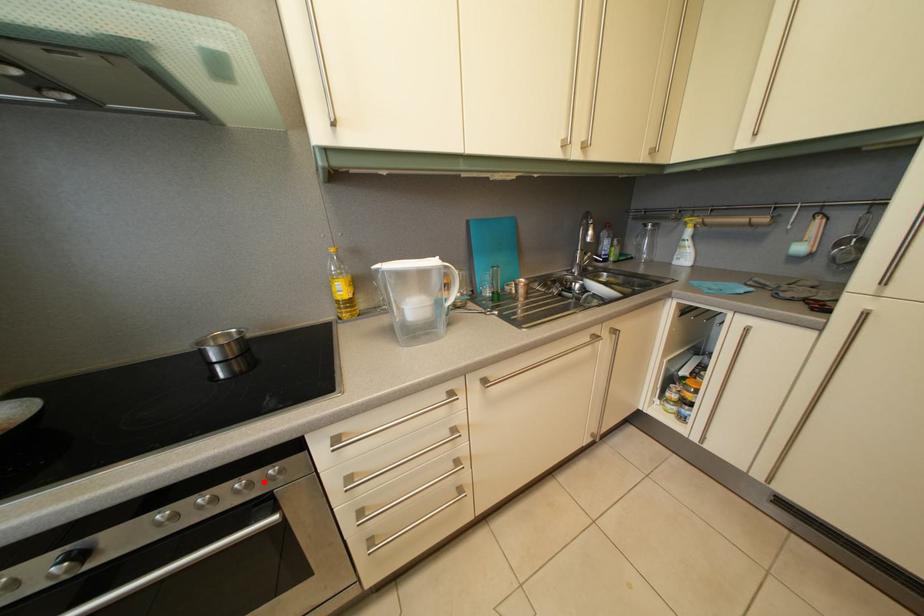
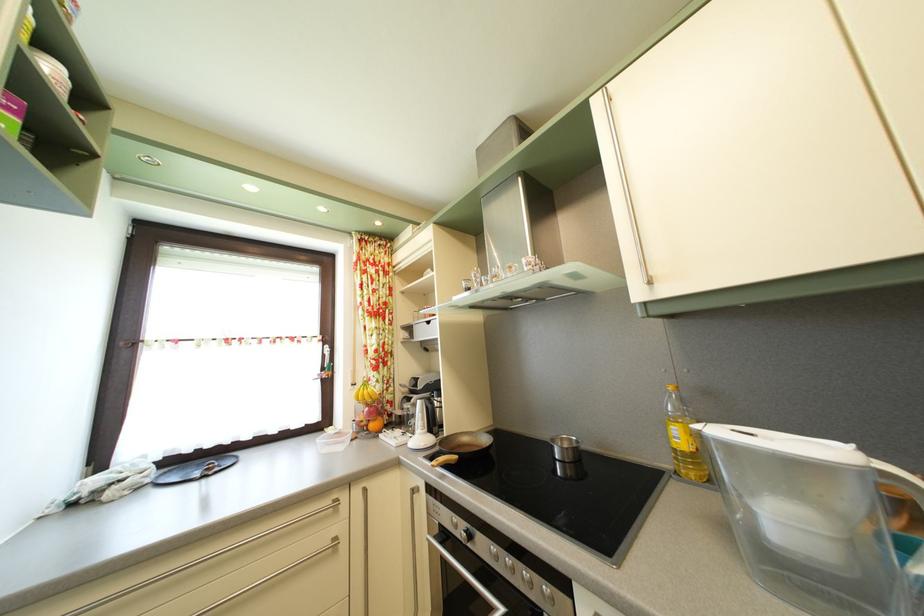
The point at the highlighted location is marked in the first image. Where is the corresponding point in the second image?

(543, 585)